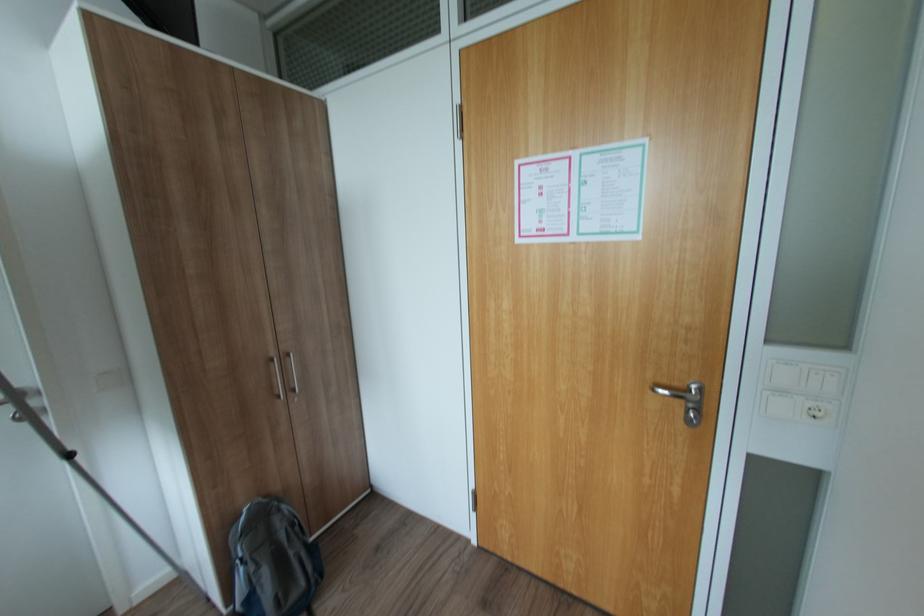
I want to click on silver door handle, so click(x=681, y=392).